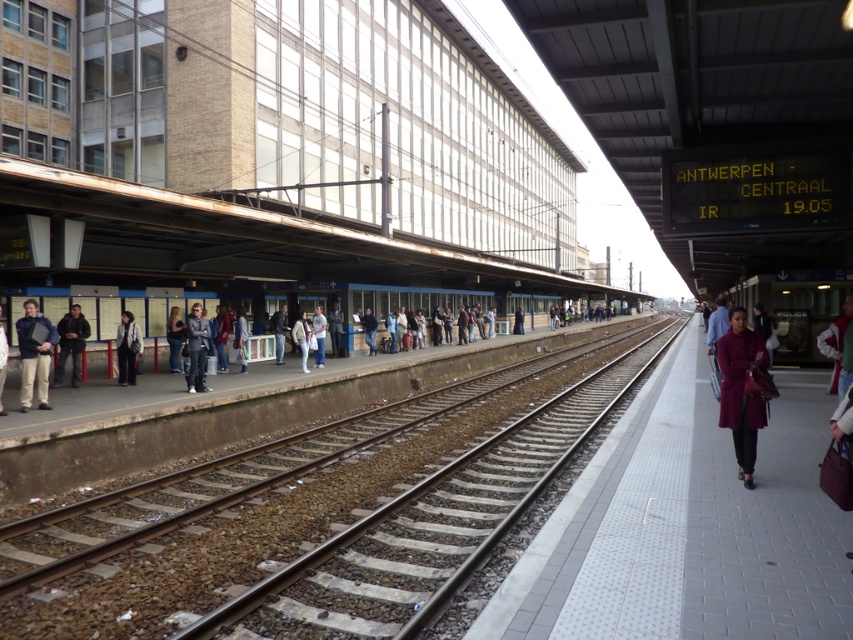
Question: Is brown gravel track at center wider than maroon coat at right?

Choices:
 (A) yes
 (B) no

Answer: (A)

Question: Estimate the real-world distances between objects in this image. Which object is farther from the dark blue jacket at left?

Choices:
 (A) brown gravel track at center
 (B) light blue jeans at left

Answer: (A)

Question: Considering the real-world distances, which object is closest to the gray fabric jacket at center?

Choices:
 (A) matte black jacket at left
 (B) maroon fabric train at right
 (C) dark gray fabric jacket at left
 (D) light blue jeans at left

Answer: (C)

Question: Does maroon fabric train at right come behind maroon coat at right?

Choices:
 (A) yes
 (B) no

Answer: (A)

Question: Does gray fabric jacket at center come in front of dark gray fabric jacket at left?

Choices:
 (A) no
 (B) yes

Answer: (B)

Question: Which of these objects is positioned farthest from the maroon fabric train at right?

Choices:
 (A) dark blue jacket at left
 (B) brown gravel track at center

Answer: (A)